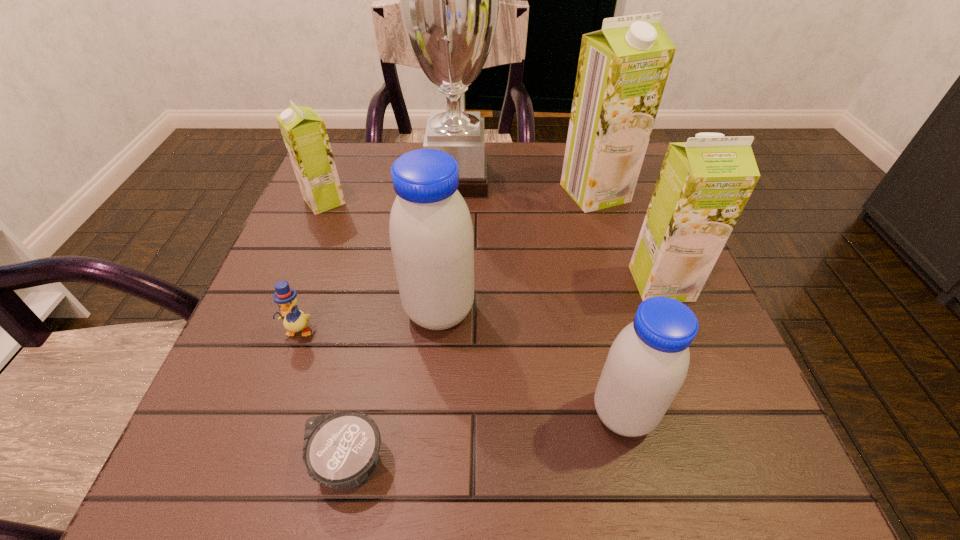
Where is `blank region between the trophy cup and the biggest green soya milk`? blank region between the trophy cup and the biggest green soya milk is located at coordinates (526, 186).

The width and height of the screenshot is (960, 540). Identify the location of free area in between the fourth soya milk from right to left and the second smallest green soya milk. (550, 297).

What are the coordinates of `vacant space in between the left blue soya milk and the duckling` in the screenshot? It's located at (369, 321).

Identify which object is located as the seventh nearest to the left blue soya milk. Please provide its 2D coordinates. Your answer should be formatted as a tuple, i.e. [(x, y)], where the tuple contains the x and y coordinates of a point satisfying the conditions above.

[(704, 184)]

Locate which object is the fifth closest to the tallest soya milk. Please provide its 2D coordinates. Your answer should be formatted as a tuple, i.e. [(x, y)], where the tuple contains the x and y coordinates of a point satisfying the conditions above.

[(303, 130)]

Choose which soya milk is the second nearest neighbor to the smallest green soya milk. Please provide its 2D coordinates. Your answer should be formatted as a tuple, i.e. [(x, y)], where the tuple contains the x and y coordinates of a point satisfying the conditions above.

[(622, 71)]

Identify which soya milk is the second nearest to the second smallest green soya milk. Please provide its 2D coordinates. Your answer should be formatted as a tuple, i.e. [(x, y)], where the tuple contains the x and y coordinates of a point satisfying the conditions above.

[(647, 364)]

Locate an element on the screen. the second closest green soya milk to the left blue soya milk is located at coordinates (622, 71).

Identify which green soya milk is located as the second nearest to the biggest green soya milk. Please provide its 2D coordinates. Your answer should be formatted as a tuple, i.e. [(x, y)], where the tuple contains the x and y coordinates of a point satisfying the conditions above.

[(303, 130)]

At what (x,y) coordinates should I click in order to perform the action: click on vacant space that satisfies the following two spatial constraints: 1. at the front view of the trophy cup; 2. on the left side of the second smallest green soya milk. Please return your answer as a coordinate pair (x, y). This screenshot has height=540, width=960. Looking at the image, I should click on (450, 283).